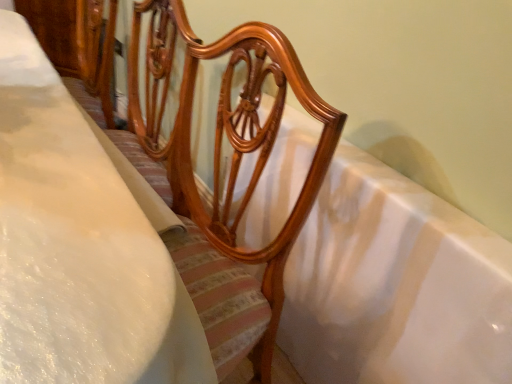
Question: Is white soft bedsheet at center positioned in front of white glossy bathtub at center?

Choices:
 (A) yes
 (B) no

Answer: (A)

Question: Does white soft bedsheet at center appear on the right side of white glossy bathtub at center?

Choices:
 (A) no
 (B) yes

Answer: (A)

Question: Is white soft bedsheet at center at the left side of white glossy bathtub at center?

Choices:
 (A) yes
 (B) no

Answer: (A)

Question: Can you confirm if white soft bedsheet at center is wider than white glossy bathtub at center?

Choices:
 (A) no
 (B) yes

Answer: (B)

Question: From the image's perspective, is white soft bedsheet at center below white glossy bathtub at center?

Choices:
 (A) yes
 (B) no

Answer: (B)

Question: Can you confirm if white soft bedsheet at center is shorter than white glossy bathtub at center?

Choices:
 (A) yes
 (B) no

Answer: (B)

Question: From the image's perspective, does white glossy bathtub at center appear lower than white soft bedsheet at center?

Choices:
 (A) no
 (B) yes

Answer: (B)

Question: Is white glossy bathtub at center completely or partially outside of white soft bedsheet at center?

Choices:
 (A) yes
 (B) no

Answer: (A)

Question: Are white glossy bathtub at center and white soft bedsheet at center located far from each other?

Choices:
 (A) yes
 (B) no

Answer: (B)

Question: Considering the relative sizes of white glossy bathtub at center and white soft bedsheet at center in the image provided, is white glossy bathtub at center bigger than white soft bedsheet at center?

Choices:
 (A) yes
 (B) no

Answer: (B)

Question: Does white glossy bathtub at center have a greater height compared to white soft bedsheet at center?

Choices:
 (A) no
 (B) yes

Answer: (A)

Question: From a real-world perspective, is white glossy bathtub at center over white soft bedsheet at center?

Choices:
 (A) yes
 (B) no

Answer: (B)

Question: Would you say white glossy bathtub at center is to the left or to the right of white soft bedsheet at center in the picture?

Choices:
 (A) right
 (B) left

Answer: (A)